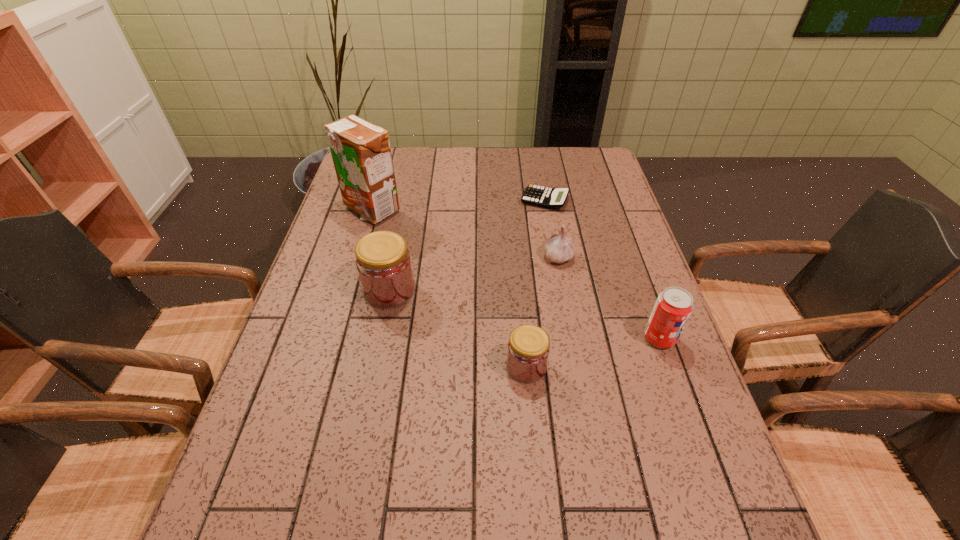
In the image, there is a desktop. At what (x,y) coordinates should I click in order to perform the action: click on vacant region at the right edge. Please return your answer as a coordinate pair (x, y). Looking at the image, I should click on (685, 393).

Locate an element on the screen. This screenshot has height=540, width=960. free space between the tallest object and the right jam is located at coordinates (448, 288).

Image resolution: width=960 pixels, height=540 pixels. I want to click on free space that is in between the calculator and the tallest object, so click(x=458, y=205).

Where is `free point between the rightmost object and the shorter jam`? The width and height of the screenshot is (960, 540). free point between the rightmost object and the shorter jam is located at coordinates (593, 352).

This screenshot has height=540, width=960. I want to click on vacant region between the nearer jam and the left jam, so click(458, 328).

I want to click on unoccupied position between the carton and the shortest object, so click(x=458, y=205).

Identify the location of vacant space that's between the soda can and the shortest object. (602, 269).

This screenshot has width=960, height=540. What are the coordinates of `vacant region between the soda can and the fourth nearest object` in the screenshot? It's located at (609, 297).

Where is `free space that is in between the shortest object and the rightmost object`? The image size is (960, 540). free space that is in between the shortest object and the rightmost object is located at coordinates (602, 269).

This screenshot has height=540, width=960. I want to click on vacant point located between the fourth nearest object and the carton, so click(x=465, y=233).